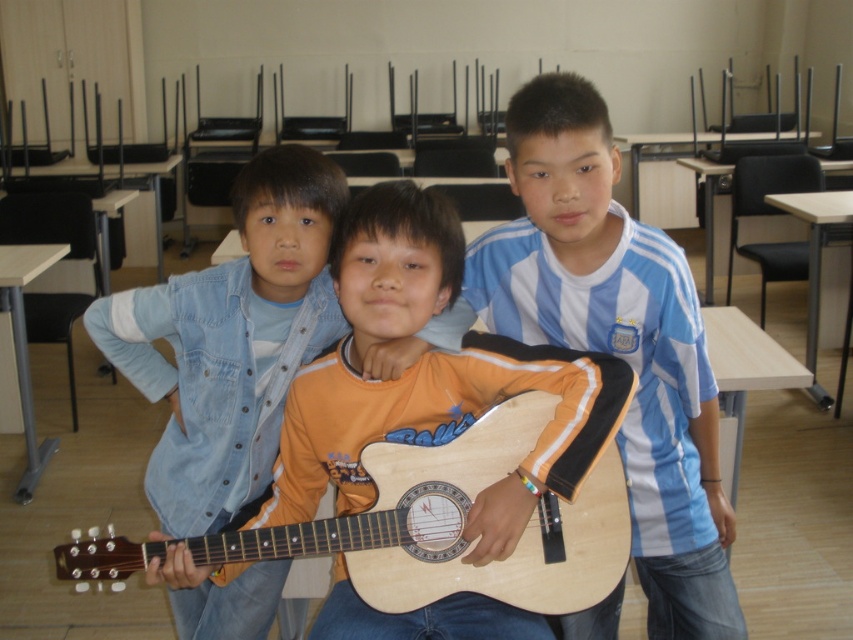
Is blue striped shirt at center taller than natural wood acoustic guitar at center?

Correct, blue striped shirt at center is much taller as natural wood acoustic guitar at center.

Consider the image. Does blue striped shirt at center appear on the left side of natural wood acoustic guitar at center?

No, blue striped shirt at center is not to the left of natural wood acoustic guitar at center.

Where is `blue striped shirt at center`? blue striped shirt at center is located at coordinates (616, 340).

Where is `blue striped shirt at center`? This screenshot has width=853, height=640. blue striped shirt at center is located at coordinates (616, 340).

Does wooden guitar at center have a greater width compared to natural wood acoustic guitar at center?

Result: No, wooden guitar at center is not wider than natural wood acoustic guitar at center.

Is point (386, 269) closer to viewer compared to point (90, 579)?

Yes, point (386, 269) is closer to viewer.

This screenshot has width=853, height=640. Find the location of `wooden guitar at center`. wooden guitar at center is located at coordinates (428, 378).

Where is `wooden guitar at center`? The height and width of the screenshot is (640, 853). wooden guitar at center is located at coordinates (428, 378).

Is blue striped shirt at center shorter than wooden guitar at center?

No, blue striped shirt at center is not shorter than wooden guitar at center.

Which is below, blue striped shirt at center or wooden guitar at center?

wooden guitar at center

I want to click on blue striped shirt at center, so click(x=616, y=340).